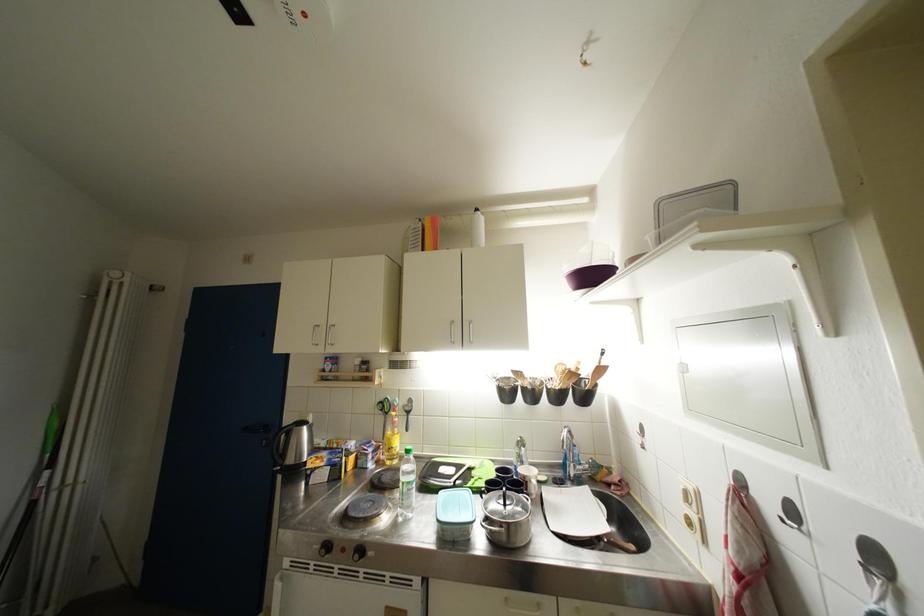
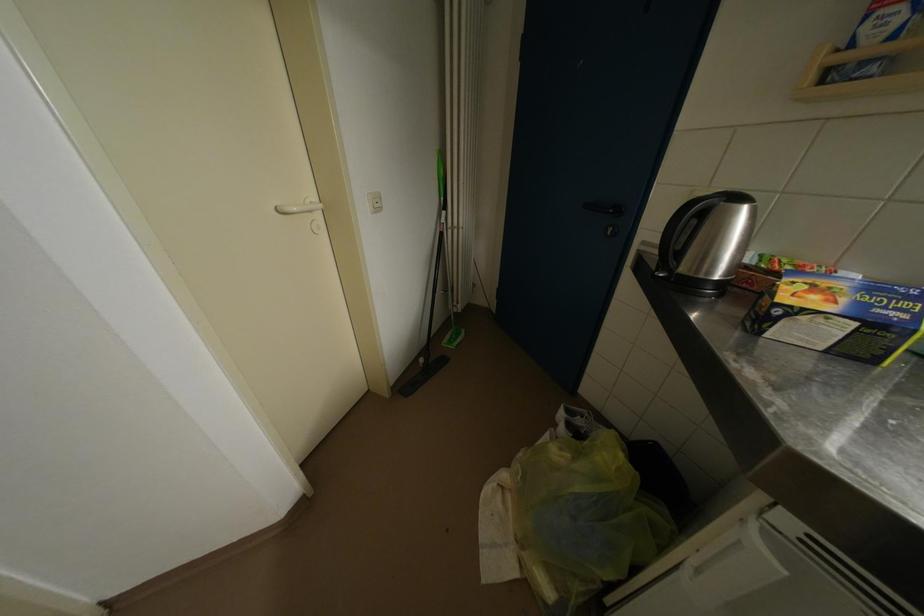
Find the pixel in the second image that matches point 315,469 in the first image.

(791, 302)